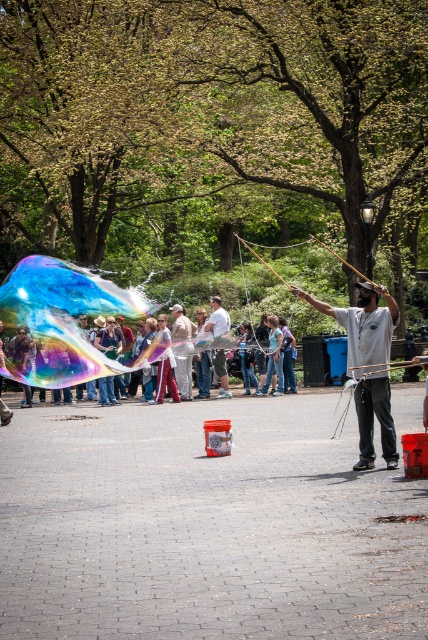
Question: Which is nearer to the rainbow iridescent bubble at center?

Choices:
 (A) matte black shirt at center
 (B) matte white shirt at center
 (C) light brown leather jacket at center

Answer: (C)

Question: Is matte black shirt at center positioned before light brown leather jacket at center?

Choices:
 (A) yes
 (B) no

Answer: (A)

Question: Estimate the real-world distances between objects in this image. Which object is closer to the matte white shirt at center?

Choices:
 (A) rainbow iridescent bubble at center
 (B) light brown leather jacket at center
 (C) matte black shirt at center

Answer: (B)

Question: Is light brown leather jacket at center smaller than matte white shirt at center?

Choices:
 (A) no
 (B) yes

Answer: (A)

Question: Is rainbow iridescent bubble at center to the right of light brown leather jacket at center from the viewer's perspective?

Choices:
 (A) yes
 (B) no

Answer: (B)

Question: Among these points, which one is nearest to the camera?

Choices:
 (A) (362, 339)
 (B) (21, 282)

Answer: (B)